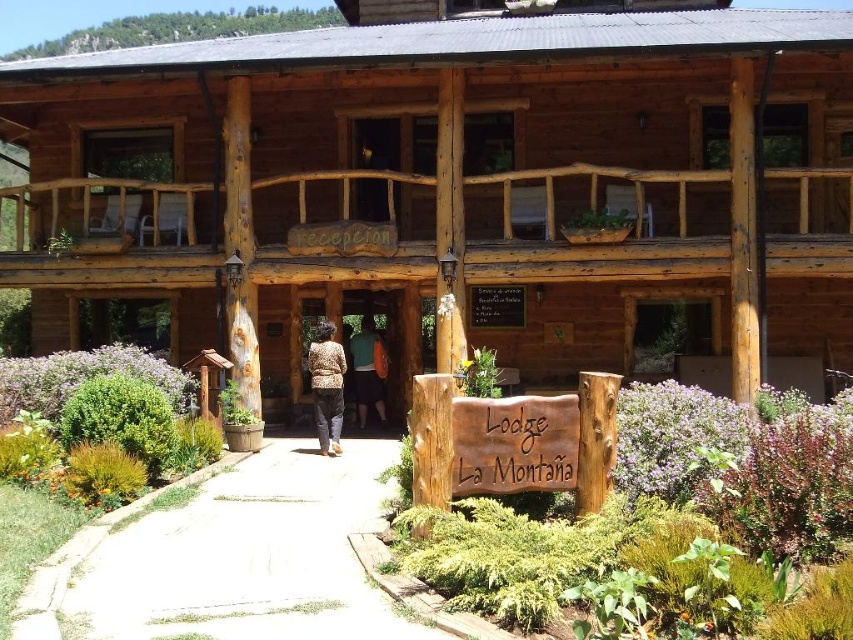
Question: Which point is closer to the camera taking this photo?

Choices:
 (A) (294, 528)
 (B) (817, 65)

Answer: (A)

Question: Which point appears closest to the camera in this image?

Choices:
 (A) (297, 541)
 (B) (410, 54)
 (C) (498, 468)

Answer: (C)

Question: Observing the image, what is the correct spatial positioning of white gravel path at center in reference to matte green backpack at center?

Choices:
 (A) below
 (B) above

Answer: (A)

Question: Observing the image, what is the correct spatial positioning of wooden cabin at center in reference to leopard print sweater at center?

Choices:
 (A) above
 (B) below

Answer: (A)

Question: Does white gravel path at center come behind leopard print sweater at center?

Choices:
 (A) no
 (B) yes

Answer: (A)

Question: Which of these objects is positioned farthest from the white gravel path at center?

Choices:
 (A) wooden cabin at center
 (B) leopard print sweater at center
 (C) brown wooden sign at center
 (D) matte green backpack at center

Answer: (A)